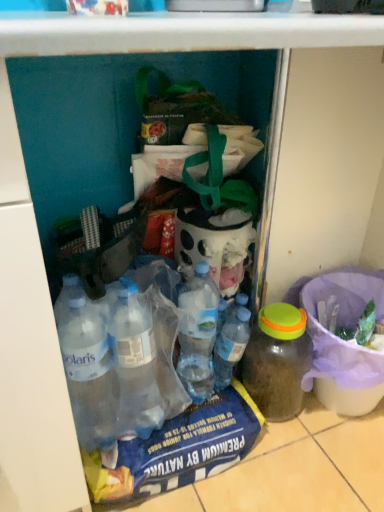
Question: Does translucent plastic bucket at lower right have a smaller size compared to transparent plastic bottle at center, which is the first bottle from left to right?

Choices:
 (A) no
 (B) yes

Answer: (A)

Question: Is translucent plastic bucket at lower right shorter than transparent plastic bottle at center, which is the first bottle from left to right?

Choices:
 (A) yes
 (B) no

Answer: (B)

Question: From a real-world perspective, is translucent plastic bucket at lower right beneath transparent plastic bottle at center, which appears as the second bottle when viewed from the right?

Choices:
 (A) yes
 (B) no

Answer: (A)

Question: Could you tell me if translucent plastic bucket at lower right is turned towards transparent plastic bottle at center, which appears as the second bottle when viewed from the right?

Choices:
 (A) yes
 (B) no

Answer: (B)

Question: Is translucent plastic bucket at lower right outside of transparent plastic bottle at center, which is the first bottle from left to right?

Choices:
 (A) yes
 (B) no

Answer: (A)

Question: Considering the relative sizes of translucent plastic bucket at lower right and transparent plastic bottle at center, which appears as the second bottle when viewed from the right, in the image provided, is translucent plastic bucket at lower right bigger than transparent plastic bottle at center, which appears as the second bottle when viewed from the right,?

Choices:
 (A) no
 (B) yes

Answer: (B)

Question: Would you say transparent plastic bottle at center, which is the first bottle from left to right, is outside translucent plastic jar at lower right, which appears as the 1th bottle when viewed from the right?

Choices:
 (A) yes
 (B) no

Answer: (A)

Question: From a real-world perspective, is transparent plastic bottle at center, which appears as the second bottle when viewed from the right, below translucent plastic jar at lower right, which appears as the 1th bottle when viewed from the right?

Choices:
 (A) yes
 (B) no

Answer: (B)

Question: Is transparent plastic bottle at center, which appears as the second bottle when viewed from the right, next to translucent plastic jar at lower right, arranged as the 2th bottle when viewed from the left?

Choices:
 (A) no
 (B) yes

Answer: (B)

Question: Does transparent plastic bottle at center, which appears as the second bottle when viewed from the right, turn towards translucent plastic jar at lower right, which appears as the 1th bottle when viewed from the right?

Choices:
 (A) no
 (B) yes

Answer: (A)

Question: Considering the relative positions of transparent plastic bottle at center, which appears as the second bottle when viewed from the right, and translucent plastic jar at lower right, arranged as the 2th bottle when viewed from the left, in the image provided, is transparent plastic bottle at center, which appears as the second bottle when viewed from the right, to the right of translucent plastic jar at lower right, arranged as the 2th bottle when viewed from the left, from the viewer's perspective?

Choices:
 (A) yes
 (B) no

Answer: (B)

Question: From the image's perspective, is transparent plastic bottle at center, which is the first bottle from left to right, above translucent plastic jar at lower right, which appears as the 1th bottle when viewed from the right?

Choices:
 (A) yes
 (B) no

Answer: (A)

Question: Does transparent plastic bottle at center, which is the first bottle from left to right, have a larger size compared to translucent plastic bucket at lower right?

Choices:
 (A) no
 (B) yes

Answer: (A)